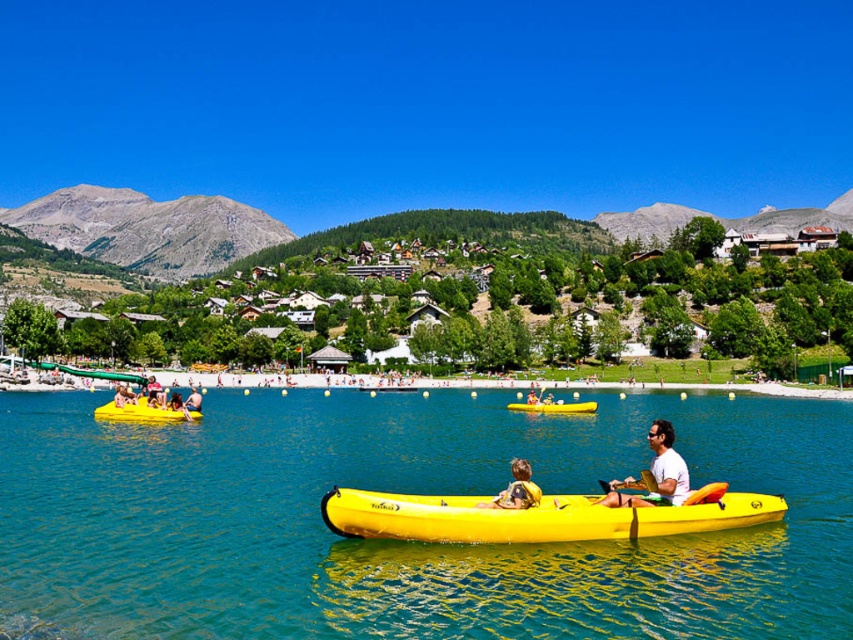
Can you confirm if white matte kayak at center is shorter than yellow rubber boat at lower left?

No.

Can you confirm if white matte kayak at center is positioned below yellow rubber boat at lower left?

Correct, white matte kayak at center is located below yellow rubber boat at lower left.

Identify the location of white matte kayak at center. The height and width of the screenshot is (640, 853). click(x=654, y=474).

The height and width of the screenshot is (640, 853). Find the location of `white matte kayak at center`. white matte kayak at center is located at coordinates (654, 474).

Measure the distance from yellow matte kayak at center to yellow fabric life vest at lower center.

yellow matte kayak at center is 13.78 feet away from yellow fabric life vest at lower center.

Between yellow matte kayak at center and yellow fabric life vest at lower center, which one is positioned lower?

Positioned lower is yellow matte kayak at center.

Locate an element on the screen. Image resolution: width=853 pixels, height=640 pixels. yellow matte kayak at center is located at coordinates (537, 516).

Does yellow rubber boat at center appear on the right side of yellow rubber boat at lower left?

Yes, yellow rubber boat at center is to the right of yellow rubber boat at lower left.

Which is below, yellow rubber boat at center or yellow rubber boat at lower left?

Positioned lower is yellow rubber boat at center.

Does point (616, 636) come in front of point (160, 412)?

Yes, it is.

The image size is (853, 640). Find the location of `yellow rubber boat at center`. yellow rubber boat at center is located at coordinates (405, 541).